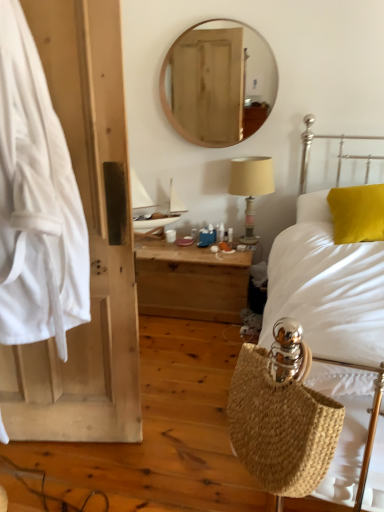
Question: Does white fabric at left turn towards wooden nightstand at center?

Choices:
 (A) no
 (B) yes

Answer: (A)

Question: Is the position of white fabric at left more distant than that of wooden nightstand at center?

Choices:
 (A) yes
 (B) no

Answer: (B)

Question: Is white fabric at left placed right next to wooden nightstand at center?

Choices:
 (A) yes
 (B) no

Answer: (B)

Question: Considering the relative sizes of white fabric at left and wooden nightstand at center in the image provided, is white fabric at left wider than wooden nightstand at center?

Choices:
 (A) no
 (B) yes

Answer: (A)

Question: Considering the relative sizes of white fabric at left and wooden nightstand at center in the image provided, is white fabric at left bigger than wooden nightstand at center?

Choices:
 (A) no
 (B) yes

Answer: (B)

Question: Is beige fabric lampshade at upper right to the left or to the right of white woven bag at right in the image?

Choices:
 (A) left
 (B) right

Answer: (A)

Question: Is beige fabric lampshade at upper right situated inside white woven bag at right or outside?

Choices:
 (A) inside
 (B) outside

Answer: (B)

Question: Is point 258,184 closer or farther from the camera than point 339,180?

Choices:
 (A) farther
 (B) closer

Answer: (B)

Question: In terms of size, does beige fabric lampshade at upper right appear bigger or smaller than white woven bag at right?

Choices:
 (A) small
 (B) big

Answer: (A)

Question: Is natural woven basket at lower right in front of or behind wooden nightstand at center in the image?

Choices:
 (A) front
 (B) behind

Answer: (A)

Question: From the image's perspective, is natural woven basket at lower right above or below wooden nightstand at center?

Choices:
 (A) above
 (B) below

Answer: (B)

Question: Based on their positions, is natural woven basket at lower right located to the left or right of wooden nightstand at center?

Choices:
 (A) right
 (B) left

Answer: (A)

Question: Considering the positions of natural woven basket at lower right and wooden nightstand at center in the image, is natural woven basket at lower right taller or shorter than wooden nightstand at center?

Choices:
 (A) short
 (B) tall

Answer: (A)

Question: Considering the positions of wooden round mirror at upper center and beige fabric lampshade at upper right in the image, is wooden round mirror at upper center bigger or smaller than beige fabric lampshade at upper right?

Choices:
 (A) big
 (B) small

Answer: (A)

Question: Is point (248, 117) closer or farther from the camera than point (264, 161)?

Choices:
 (A) farther
 (B) closer

Answer: (A)